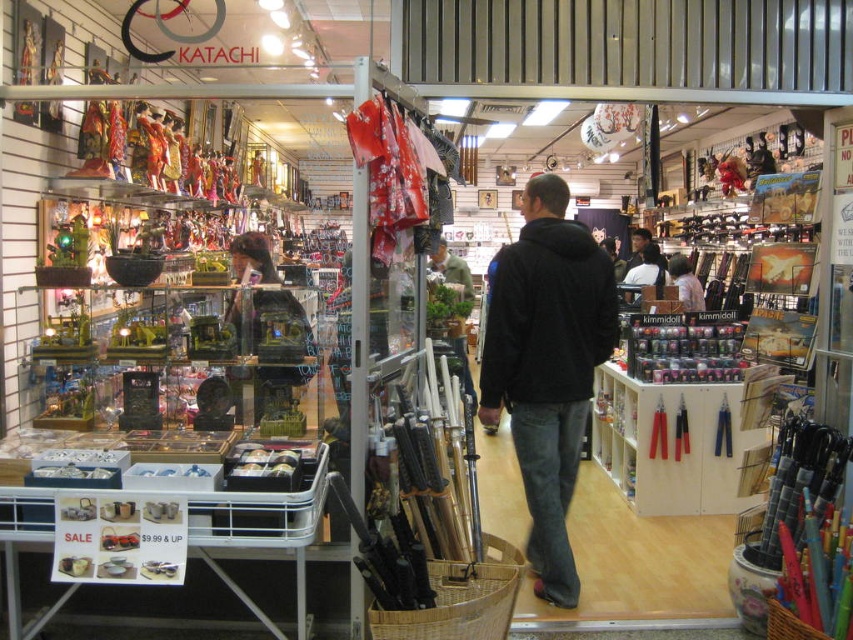
Question: Which point is closer to the camera?

Choices:
 (A) black cotton hoodie at center
 (B) dark brown leather jacket at center

Answer: (A)

Question: Does black cotton hoodie at center appear on the right side of dark brown leather jacket at center?

Choices:
 (A) no
 (B) yes

Answer: (A)

Question: Can you confirm if black cotton hoodie at center is positioned to the right of black fleece sweatshirt at center?

Choices:
 (A) yes
 (B) no

Answer: (B)

Question: Which is nearer to the black cotton hoodie at center?

Choices:
 (A) dark brown leather jacket at center
 (B) black fleece sweatshirt at center

Answer: (B)

Question: Is black cotton hoodie at center wider than black fleece sweatshirt at center?

Choices:
 (A) no
 (B) yes

Answer: (A)

Question: Among these points, which one is nearest to the camera?

Choices:
 (A) (688, 260)
 (B) (560, 584)
 (C) (653, 276)
 (D) (558, 378)

Answer: (D)